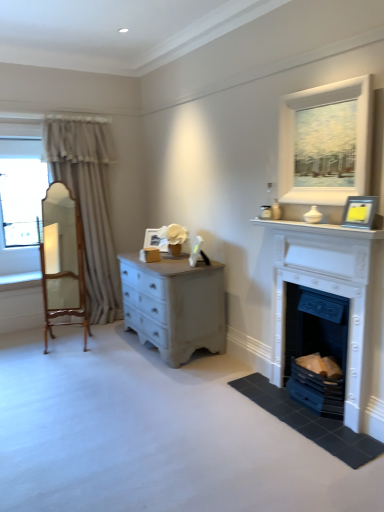
Question: Does white glossy mantle at upper right have a larger size compared to beige fabric curtain at left?

Choices:
 (A) no
 (B) yes

Answer: (A)

Question: Can you confirm if white glossy mantle at upper right is smaller than beige fabric curtain at left?

Choices:
 (A) yes
 (B) no

Answer: (A)

Question: Is beige fabric curtain at left inside white glossy mantle at upper right?

Choices:
 (A) no
 (B) yes

Answer: (A)

Question: From a real-world perspective, does white glossy mantle at upper right sit lower than beige fabric curtain at left?

Choices:
 (A) yes
 (B) no

Answer: (B)

Question: From a real-world perspective, does white glossy mantle at upper right stand above beige fabric curtain at left?

Choices:
 (A) no
 (B) yes

Answer: (B)

Question: Choose the correct answer: Is white painted stone fireplace at right, acting as the 2th fireplace starting from the bottom, inside beige fabric curtain at left or outside it?

Choices:
 (A) inside
 (B) outside

Answer: (B)

Question: Considering the positions of white painted stone fireplace at right, the first fireplace viewed from the top, and beige fabric curtain at left in the image, is white painted stone fireplace at right, the first fireplace viewed from the top, bigger or smaller than beige fabric curtain at left?

Choices:
 (A) small
 (B) big

Answer: (A)

Question: In terms of height, does white painted stone fireplace at right, the first fireplace viewed from the top, look taller or shorter compared to beige fabric curtain at left?

Choices:
 (A) tall
 (B) short

Answer: (B)

Question: Does point (382, 309) appear closer or farther from the camera than point (104, 226)?

Choices:
 (A) closer
 (B) farther

Answer: (A)

Question: Is beige fabric curtain at left wider or thinner than white painted fireplace at lower right, which is the second fireplace from top to bottom?

Choices:
 (A) thin
 (B) wide

Answer: (B)

Question: Is beige fabric curtain at left in front of or behind white painted fireplace at lower right, which is the second fireplace from top to bottom, in the image?

Choices:
 (A) front
 (B) behind

Answer: (B)

Question: Is point (99, 184) closer or farther from the camera than point (294, 354)?

Choices:
 (A) closer
 (B) farther

Answer: (B)

Question: From a real-world perspective, is beige fabric curtain at left physically located above or below white painted fireplace at lower right, which is the second fireplace from top to bottom?

Choices:
 (A) below
 (B) above

Answer: (B)

Question: From their relative heights in the image, would you say white painted stone fireplace at right, acting as the 2th fireplace starting from the bottom, is taller or shorter than white matte picture frame at center, which is the 1th picture frame from left to right?

Choices:
 (A) short
 (B) tall

Answer: (B)

Question: Is point (271, 352) closer or farther from the camera than point (153, 245)?

Choices:
 (A) farther
 (B) closer

Answer: (B)